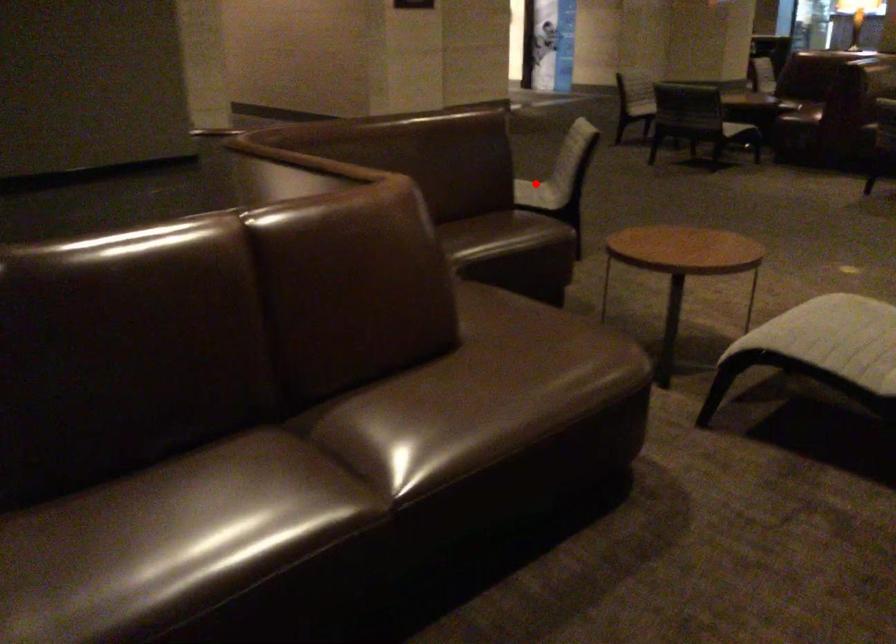
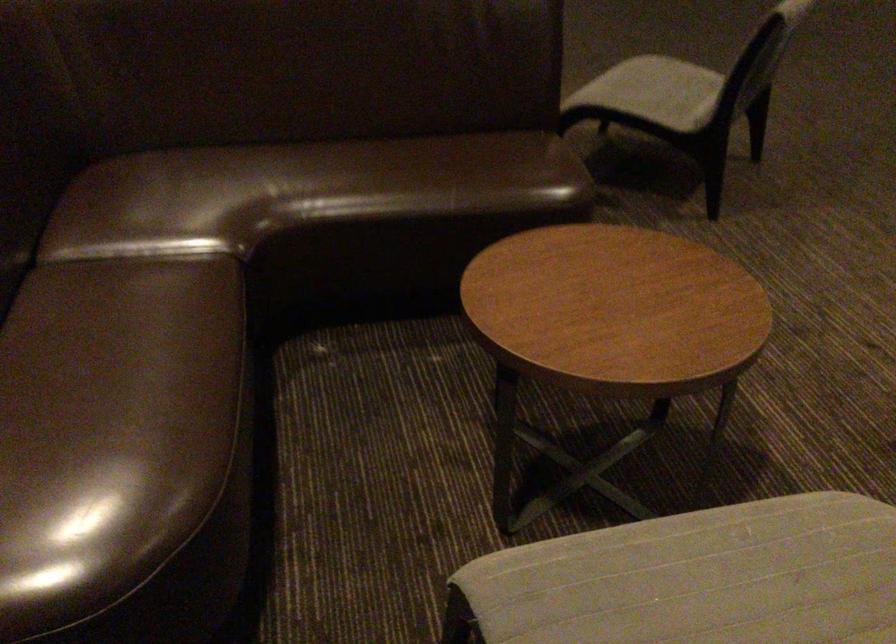
Find the pixel in the second image that matches the highlighted location in the first image.

(655, 91)